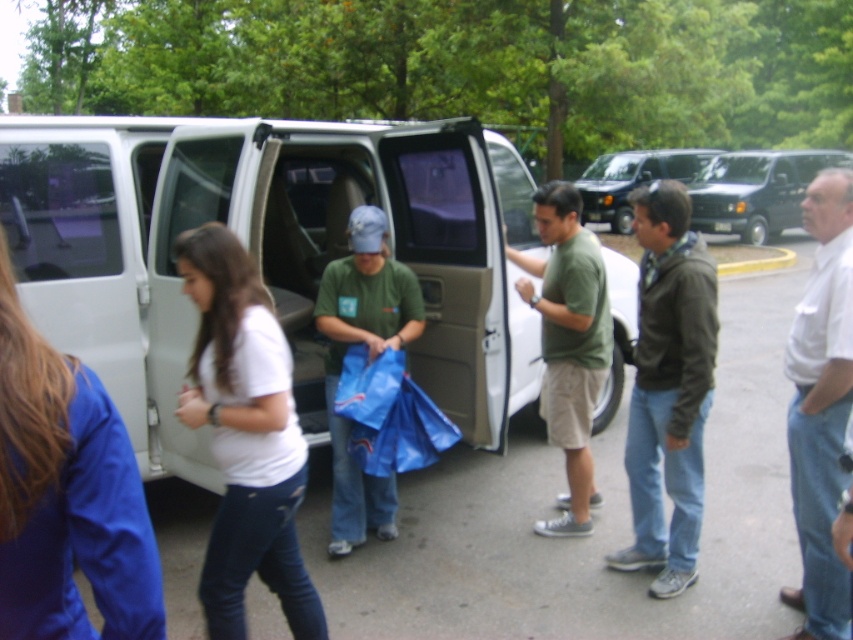
You are a delivery person who needs to load packages into the white matte van at center. You see the white cotton shirt at right standing nearby. Which side of the van should you approach to load the packages?

The white matte van at center is to the left of the white cotton shirt at right, so you should approach the right side of the van to load the packages since the shirt is on the right side relative to the van.

You are standing at the point marked by coordinates [668,387] in the image. What object or person is located exactly at this point?

The point marked by coordinates [668,387] corresponds to the dark green jacket at center.